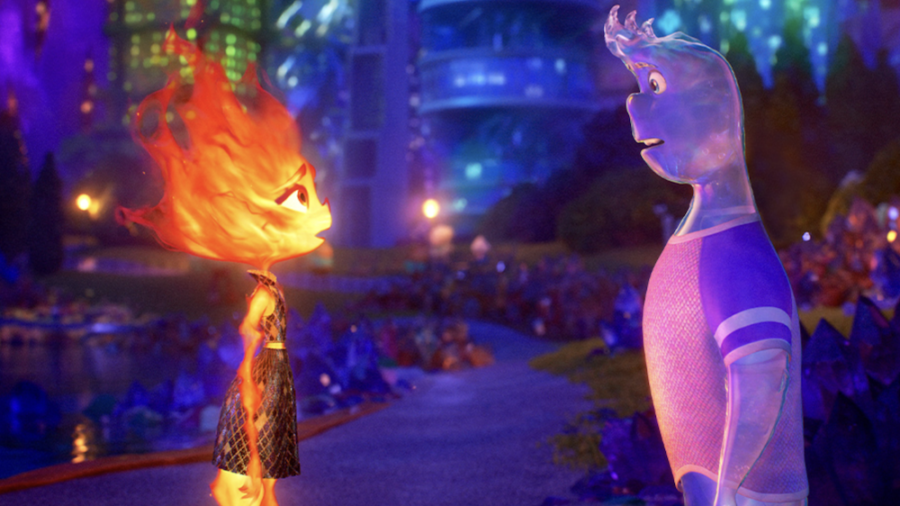
This screenshot has width=900, height=506. I want to click on floor, so click(x=457, y=427).